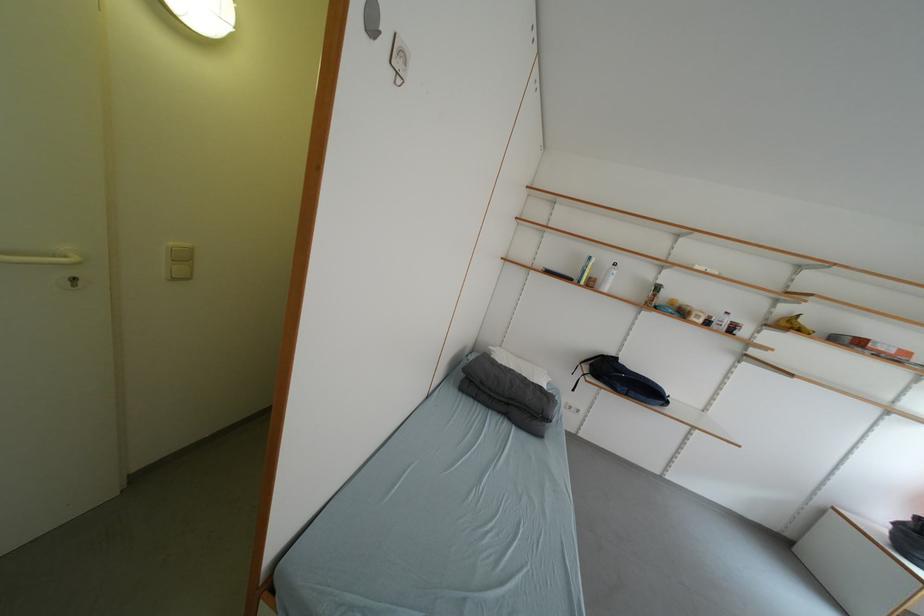
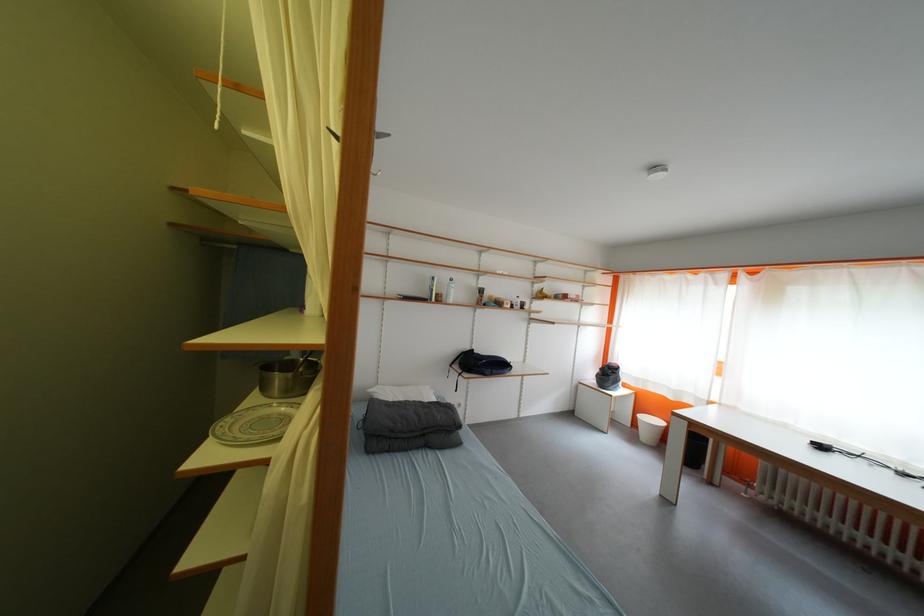
Where in the second image is the point corresponding to the point at 517,408 from the first image?

(432, 438)